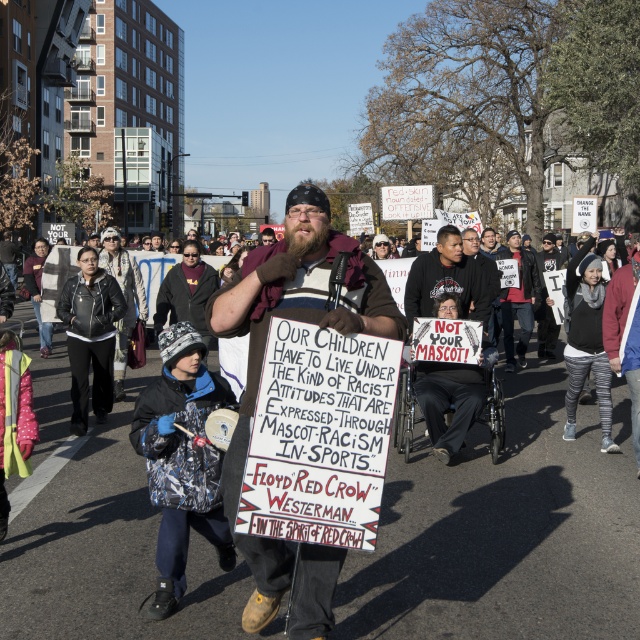
Based on the photo, you are a photographer trying to capture a clear photo of both the brown leather jacket at center and the black fabric shirt at center. Which one should you focus on first if you want to ensure both are in the frame?

The brown leather jacket at center is positioned on the left side of black fabric shirt at center, so you should focus on the brown leather jacket at center first to ensure both are in the frame.

You are a photographer standing at the scene of the protest. You want to capture a closeup shot of the brown leather jacket at center without moving the subject. Given that your camera has a minimum focusing distance of 10 feet, will you be able to take the photo?

The brown leather jacket at center and viewer are 9.86 feet apart, so the distance is less than the camera minimum focusing distance of 10 feet. Therefore, you cannot take the photo as the camera cannot focus that close.